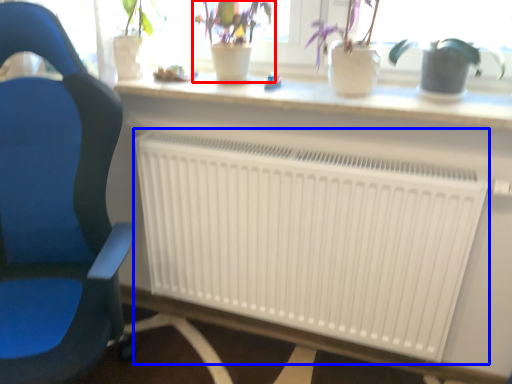
Question: Among these objects, which one is nearest to the camera, houseplant (highlighted by a red box) or radiator (highlighted by a blue box)?

Choices:
 (A) houseplant
 (B) radiator

Answer: (B)